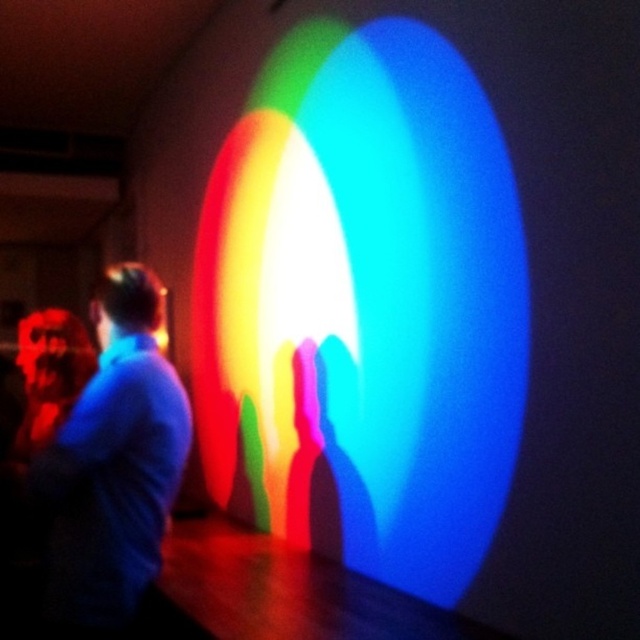
Between translucent rainbow light at center and blue fabric shirt at left, which one appears on the left side from the viewer's perspective?

blue fabric shirt at left

Which is behind, point (438, 163) or point (148, 582)?

The point (438, 163) is more distant.

Does point (282, 244) come farther from viewer compared to point (179, 465)?

Yes, point (282, 244) is behind point (179, 465).

At what (x,y) coordinates should I click in order to perform the action: click on translucent rainbow light at center. Please return your answer as a coordinate pair (x, y). Looking at the image, I should click on (364, 307).